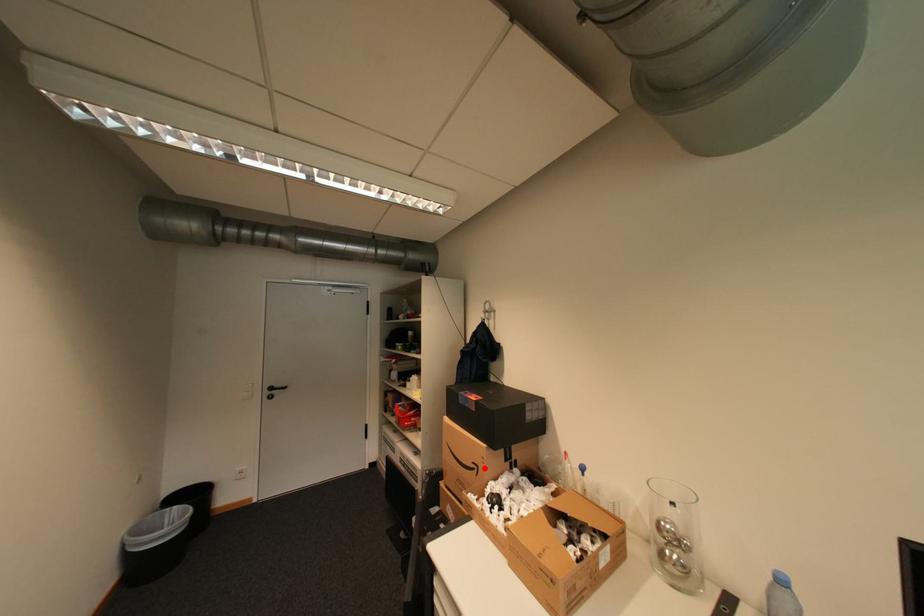
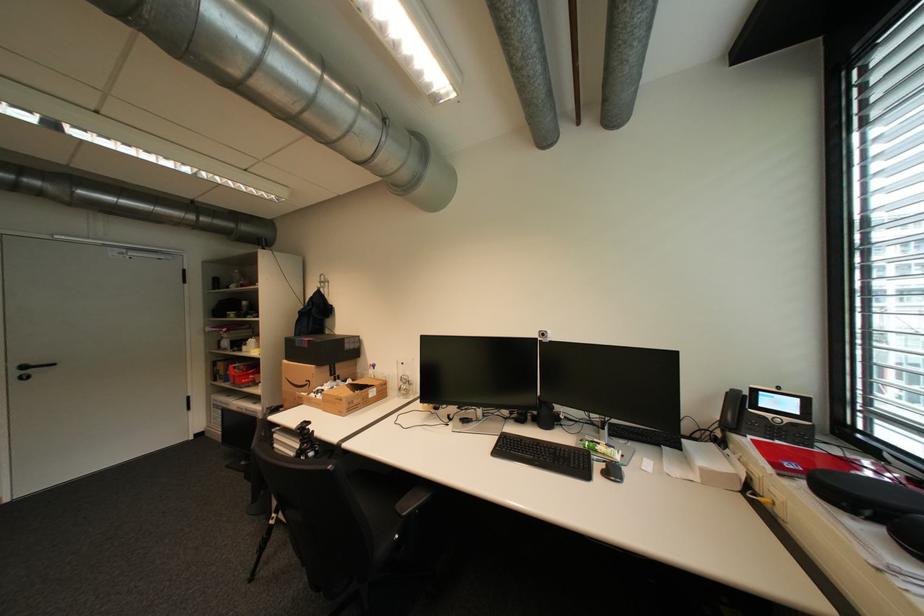
Question: A red point is marked in image1. In image2, is the corresponding 3D point closer to the camera or farther? Reply with the corresponding letter.

Choices:
 (A) The corresponding 3D point is closer.
 (B) The corresponding 3D point is farther.

Answer: (A)